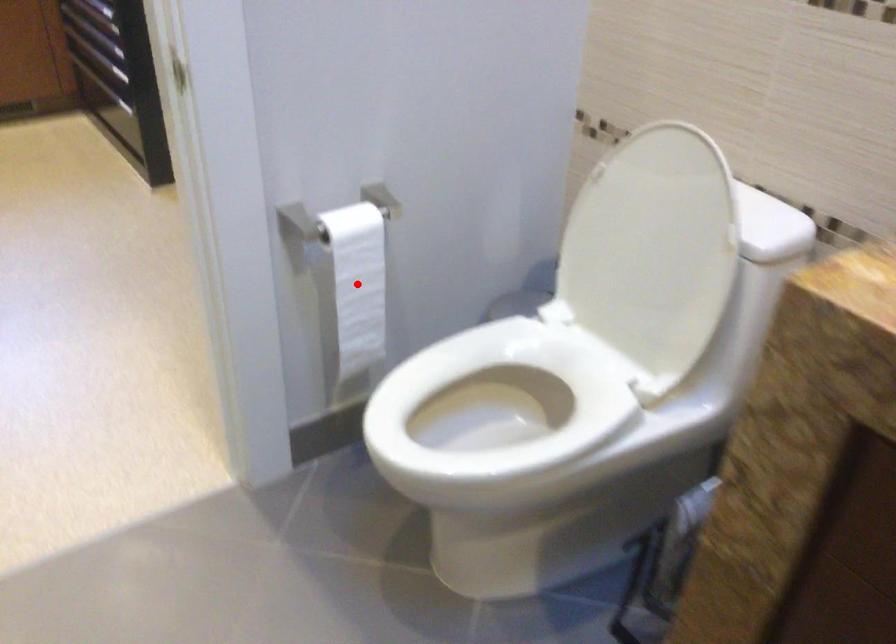
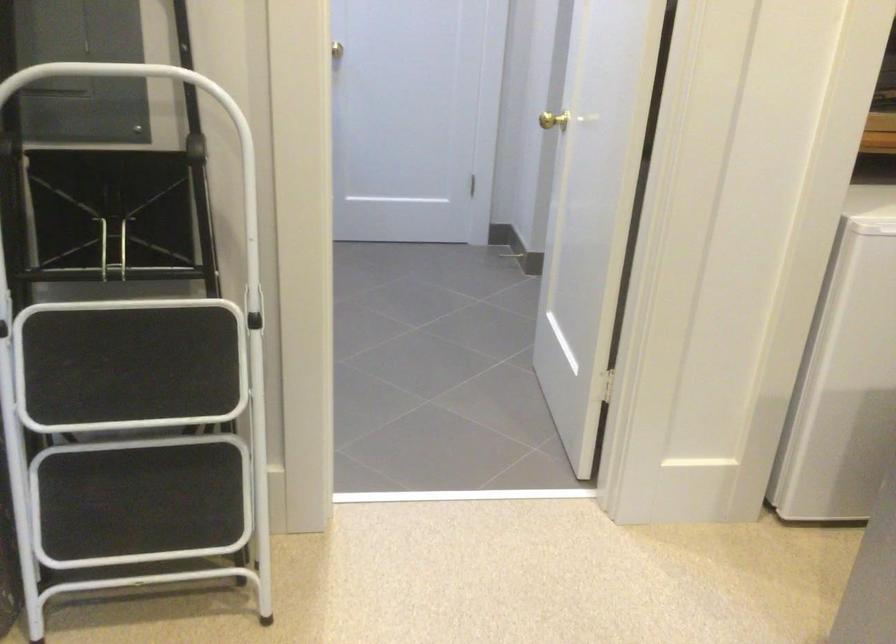
Question: I am providing you with two images of the same scene from different viewpoints. A red point is marked on the first image. At the location where the point appears in image 1, is it still visible in image 2?

Choices:
 (A) Yes
 (B) No

Answer: (B)